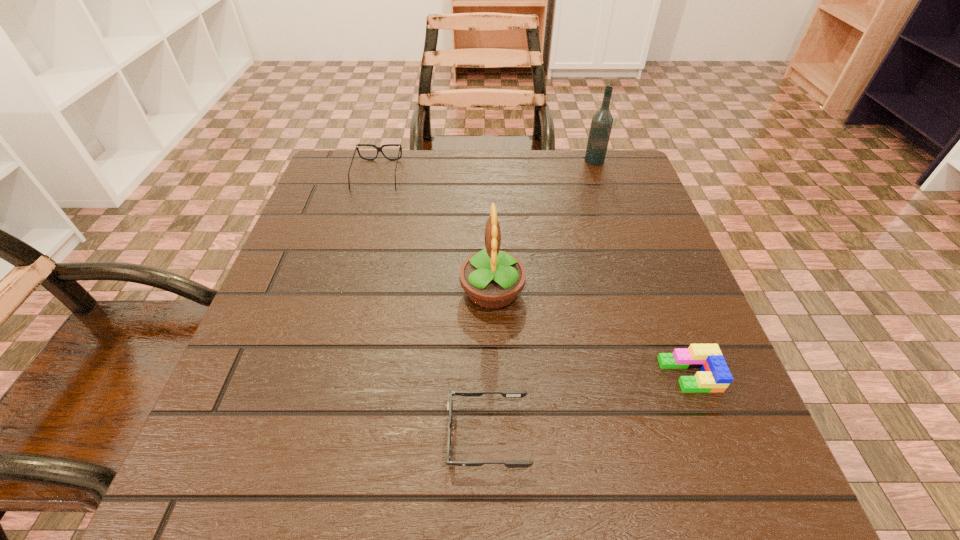
In order to click on object that stands as the third closest to the vodka in this screenshot , I will do `click(715, 376)`.

Identify which object is the fourth nearest to the shortest object. Please provide its 2D coordinates. Your answer should be formatted as a tuple, i.e. [(x, y)], where the tuple contains the x and y coordinates of a point satisfying the conditions above.

[(601, 125)]

This screenshot has width=960, height=540. I want to click on vacant space that satisfies the following two spatial constraints: 1. on the face of the Lego; 2. on the right side of the third farthest object, so click(x=494, y=375).

This screenshot has width=960, height=540. In order to click on vacant position in the image that satisfies the following two spatial constraints: 1. on the back side of the Lego; 2. on the face of the sunflower in this screenshot , I will do `click(658, 291)`.

The image size is (960, 540). Identify the location of free point that satisfies the following two spatial constraints: 1. on the front side of the vodka; 2. on the face of the third nearest object. (638, 291).

Locate an element on the screen. This screenshot has height=540, width=960. vacant space that satisfies the following two spatial constraints: 1. with the lenses facing outward on the second nearest object; 2. on the left side of the leftmost object is located at coordinates (320, 375).